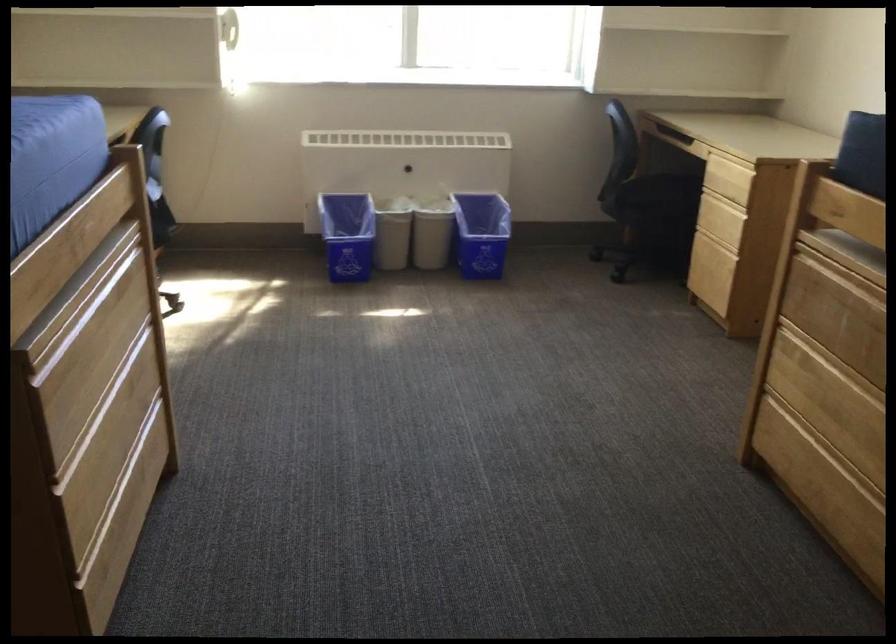
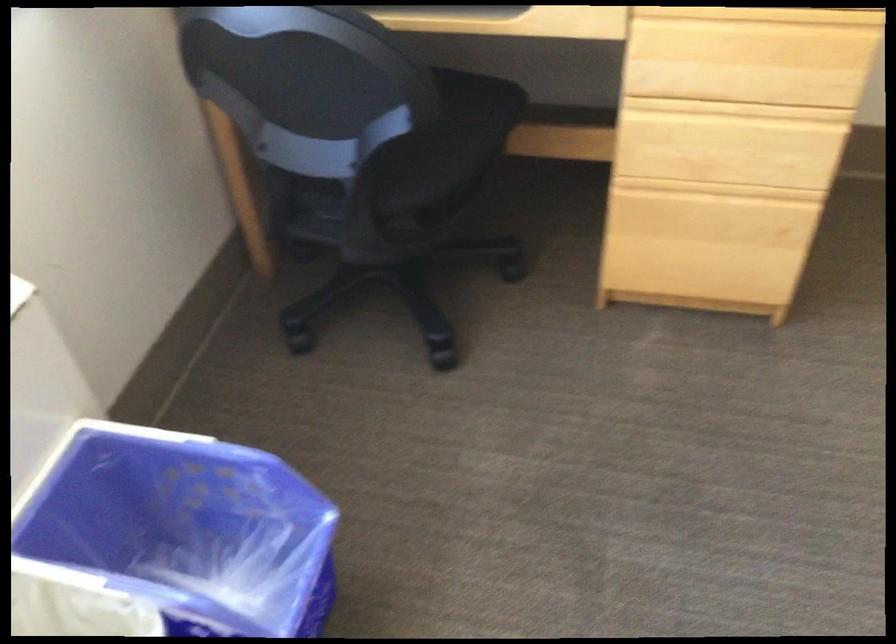
The point at (711, 234) is marked in the first image. Where is the corresponding point in the second image?

(718, 190)